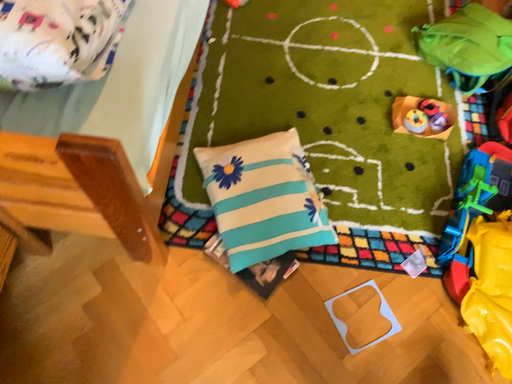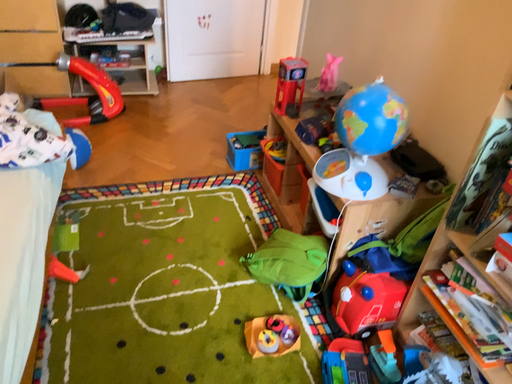
Question: Which way did the camera rotate in the video?

Choices:
 (A) rotated right
 (B) rotated left

Answer: (A)